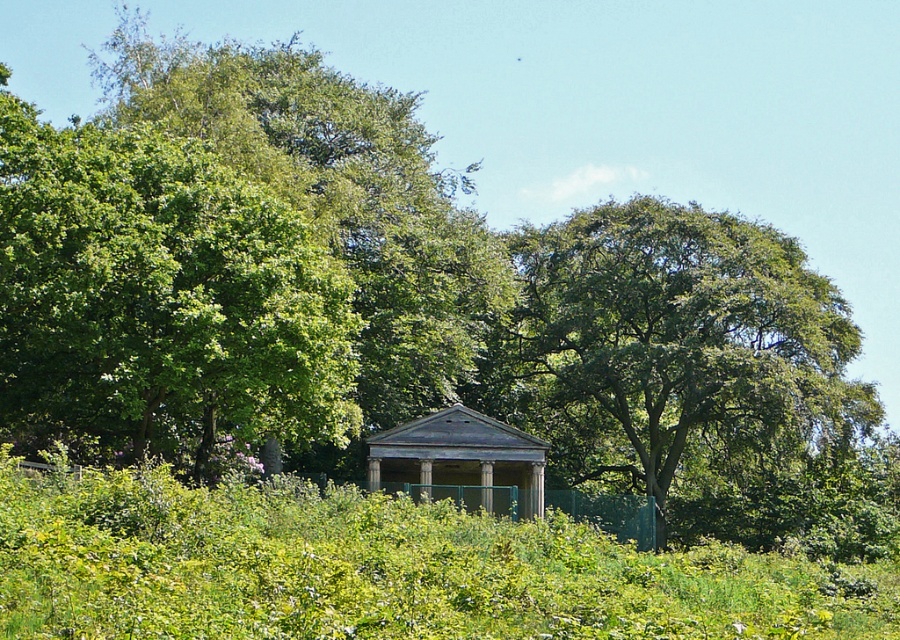
Which of these two, green leafy tree at upper left or green leafy tree at upper right, stands shorter?

With less height is green leafy tree at upper left.

Where is `green leafy tree at upper left`? green leafy tree at upper left is located at coordinates (160, 300).

Which is in front, point (146, 253) or point (691, 442)?

Positioned in front is point (146, 253).

I want to click on green leafy tree at upper left, so click(x=160, y=300).

At what (x,y) coordinates should I click in order to perform the action: click on green leafy tree at upper left. Please return your answer as a coordinate pair (x, y). The image size is (900, 640). Looking at the image, I should click on (160, 300).

Can you confirm if green leafy tree at upper left is positioned above weathered wood gazebo at center?

Yes, green leafy tree at upper left is above weathered wood gazebo at center.

In order to click on green leafy tree at upper left in this screenshot , I will do `click(160, 300)`.

Between point (587, 384) and point (498, 500), which one is positioned in front?

Positioned in front is point (498, 500).

Locate an element on the screen. The height and width of the screenshot is (640, 900). green leafy tree at upper right is located at coordinates (680, 362).